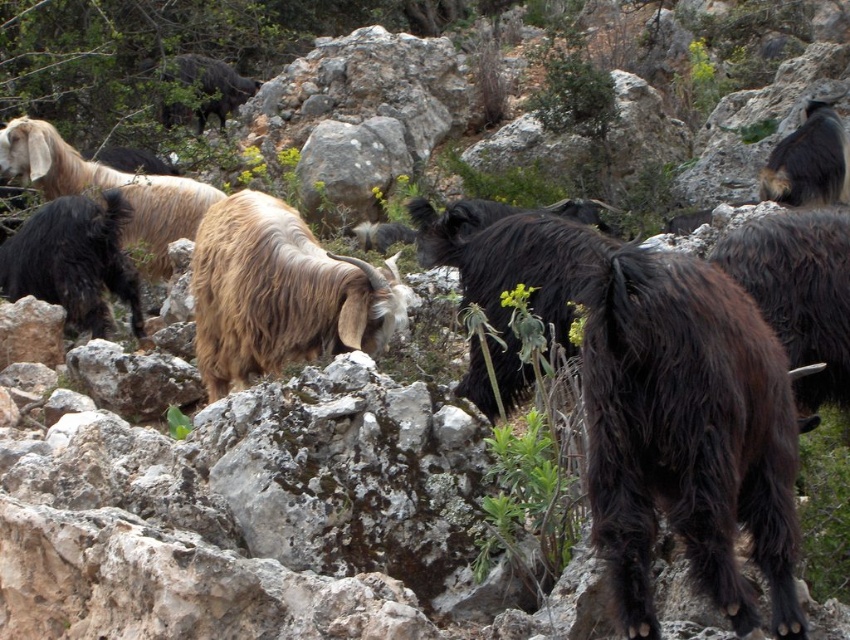
Question: Which point is farther to the camera?

Choices:
 (A) (41, 189)
 (B) (799, 216)

Answer: (A)

Question: Is dark brown woolen goat at left to the left of dark brown woolen ram at upper center from the viewer's perspective?

Choices:
 (A) no
 (B) yes

Answer: (A)

Question: Which point is farther to the camera?

Choices:
 (A) (208, 369)
 (B) (775, 269)
 (C) (820, 102)

Answer: (C)

Question: Which point appears closest to the camera in this image?

Choices:
 (A) (281, 292)
 (B) (173, 70)
 (C) (848, 182)
 (D) (58, 234)

Answer: (A)

Question: Does brown woolen goat at center have a greater width compared to dark brown woolen ram at upper right?

Choices:
 (A) no
 (B) yes

Answer: (B)

Question: Can you confirm if dark brown woolen goat at left is smaller than light brown woolly goat at upper left?

Choices:
 (A) no
 (B) yes

Answer: (B)